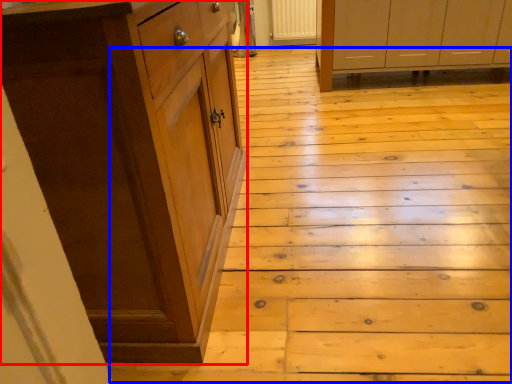
Question: Which object is closer to the camera taking this photo, cabinetry (highlighted by a red box) or stair (highlighted by a blue box)?

Choices:
 (A) cabinetry
 (B) stair

Answer: (A)